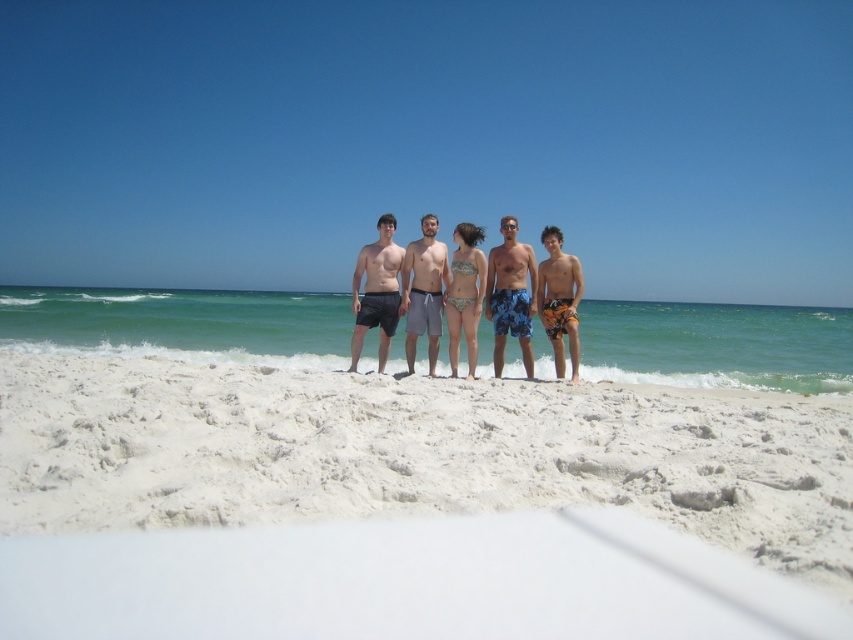
Which is behind, point (364, 284) or point (444, 282)?

The point (364, 284) is more distant.

Is point (378, 310) in front of point (412, 273)?

Yes.

You are a GUI agent. You are given a task and a screenshot of the screen. Output one action in this format:
    pyautogui.click(x=<x>, y=<y>)
    Task: Click on the matte black shorts at center
    
    Given the screenshot: What is the action you would take?
    pyautogui.click(x=376, y=291)

Is matte black shorts at center wider than multicolored swim trunks at center?

Yes, matte black shorts at center is wider than multicolored swim trunks at center.

Can you confirm if matte black shorts at center is positioned above multicolored swim trunks at center?

Yes, matte black shorts at center is above multicolored swim trunks at center.

Measure the distance between point [360,268] and camera.

A distance of 11.26 meters exists between point [360,268] and camera.

Identify the location of matte black shorts at center. (376, 291).

Is multicolored swim trunks at center positioned behind printed bikini at center?

That is True.

Can you confirm if multicolored swim trunks at center is positioned to the right of printed bikini at center?

Yes, multicolored swim trunks at center is to the right of printed bikini at center.

What do you see at coordinates (560, 300) in the screenshot? I see `multicolored swim trunks at center` at bounding box center [560, 300].

This screenshot has height=640, width=853. I want to click on multicolored swim trunks at center, so click(x=560, y=300).